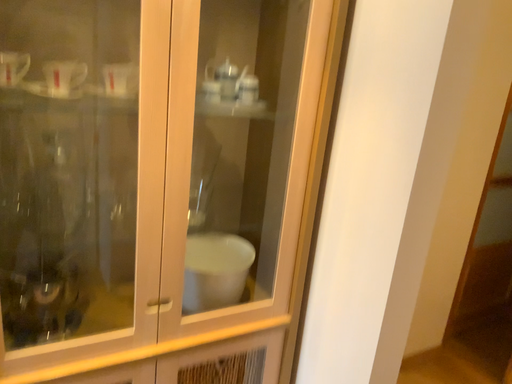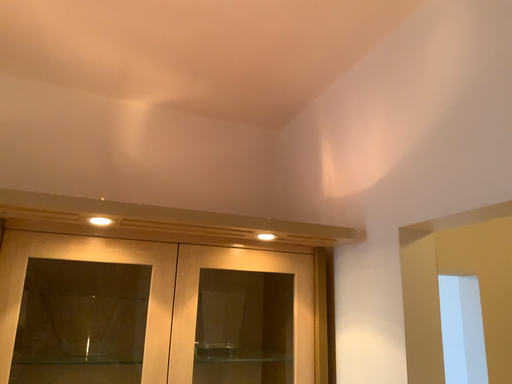
Question: Which way did the camera rotate in the video?

Choices:
 (A) rotated downward
 (B) rotated upward

Answer: (B)